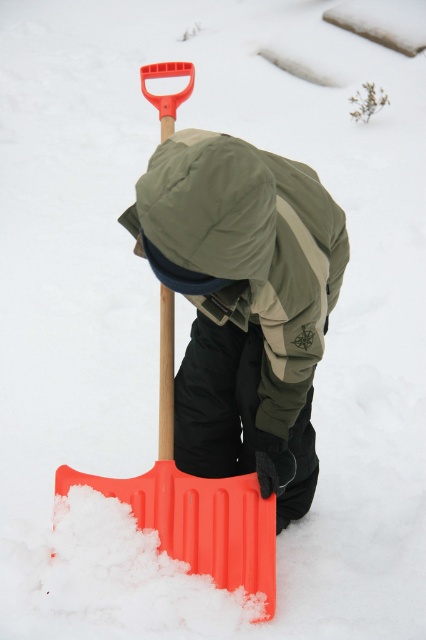
You are a photographer trying to capture the person shoveling snow. You want to ensure both the green matte jacket at center and the orange plastic shovel at center are clearly visible in the frame. Based on their heights, which object should you focus on first to ensure proper depth of field?

The green matte jacket at center has a lesser height compared to the orange plastic shovel at center, so you should focus on the orange plastic shovel at center first to ensure both are in focus since it is taller and further away.

You are standing 10 feet away from the green matte jacket at center. Can you reach it without moving closer?

The green matte jacket at center is 7.71 feet away from the viewer, so yes, you can reach it without moving closer since it is within the 10 feet distance.